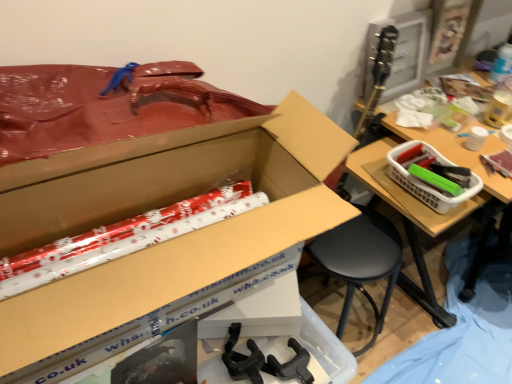
Question: Is point (144, 278) positioned closer to the camera than point (429, 145)?

Choices:
 (A) farther
 (B) closer

Answer: (B)

Question: From a real-world perspective, is cardboard box at center above or below white plastic basket at right?

Choices:
 (A) above
 (B) below

Answer: (A)

Question: Is cardboard box at center inside or outside of white plastic basket at right?

Choices:
 (A) outside
 (B) inside

Answer: (A)

Question: Is white plastic basket at right wider or thinner than cardboard box at center?

Choices:
 (A) wide
 (B) thin

Answer: (B)

Question: Visually, is white plastic basket at right positioned to the left or to the right of cardboard box at center?

Choices:
 (A) left
 (B) right

Answer: (B)

Question: Do you think white plastic basket at right is within cardboard box at center, or outside of it?

Choices:
 (A) outside
 (B) inside

Answer: (A)

Question: From the image's perspective, is white plastic basket at right positioned above or below cardboard box at center?

Choices:
 (A) above
 (B) below

Answer: (A)